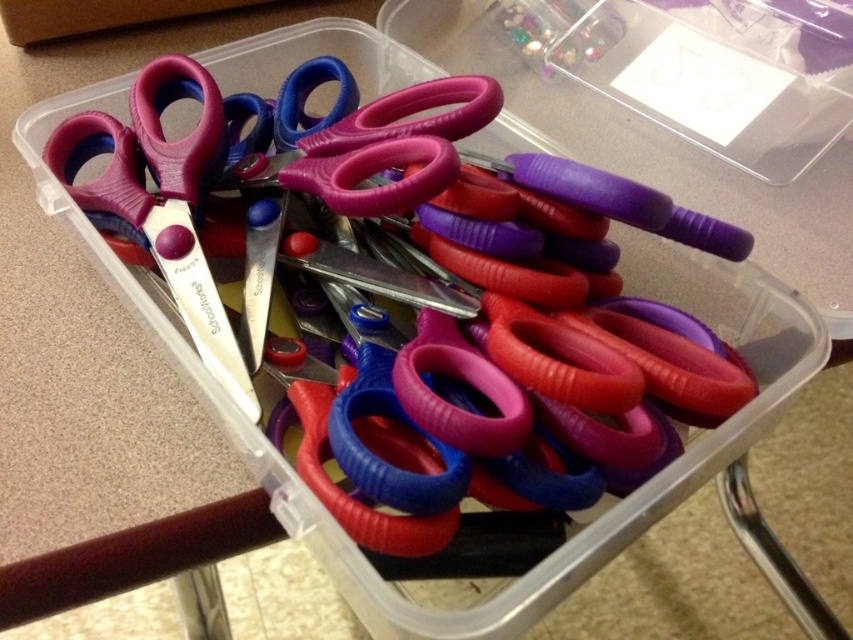
Who is positioned more to the left, matte plastic scissors at center or matte purple scissors at left?

matte purple scissors at left

Does point (186, 209) come farther from viewer compared to point (219, 168)?

No, (186, 209) is in front of (219, 168).

Identify the location of matte plastic scissors at center. (415, 301).